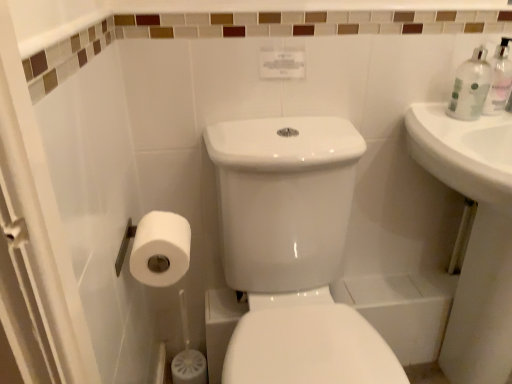
Question: From a real-world perspective, is white matte toilet paper at lower left physically located above or below clear plastic bottle at upper right?

Choices:
 (A) below
 (B) above

Answer: (A)

Question: Considering the relative positions of white matte toilet paper at lower left and clear plastic bottle at upper right in the image provided, is white matte toilet paper at lower left to the left or to the right of clear plastic bottle at upper right?

Choices:
 (A) left
 (B) right

Answer: (A)

Question: Which is nearer to the white glossy porcelain at center?

Choices:
 (A) clear plastic bottle at upper right
 (B) white glossy sink at right
 (C) clear plastic bottle at upper right
 (D) white matte toilet paper at lower left

Answer: (D)

Question: Which object is the closest to the white matte toilet paper at lower left?

Choices:
 (A) white glossy porcelain at center
 (B) clear plastic bottle at upper right
 (C) white glossy sink at right
 (D) clear plastic bottle at upper right

Answer: (A)